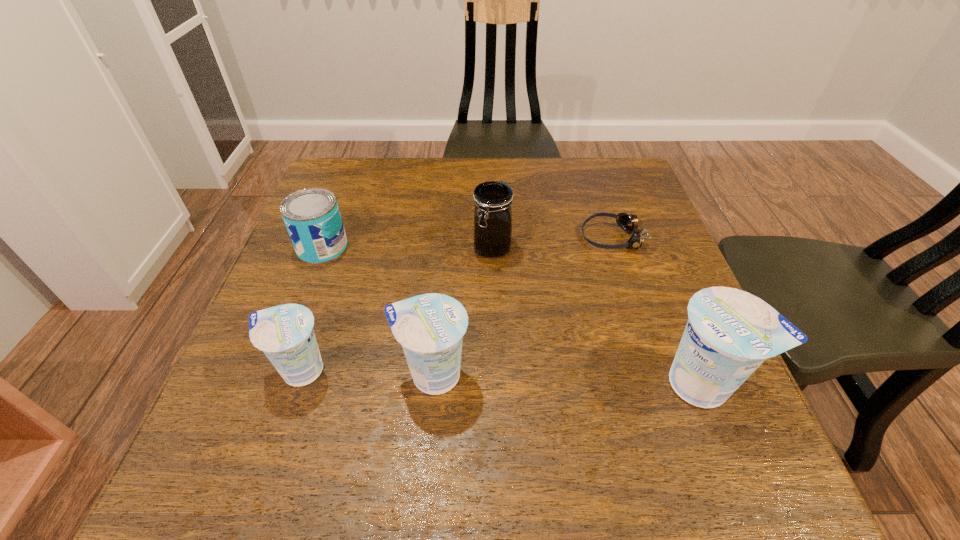
Locate an element on the screen. The image size is (960, 540). object that is at the near right corner is located at coordinates (730, 333).

Identify the location of blank space at the far edge of the desktop. The width and height of the screenshot is (960, 540). pyautogui.click(x=417, y=186).

The image size is (960, 540). I want to click on vacant space at the near edge of the desktop, so click(332, 431).

The image size is (960, 540). In order to click on vacant space at the left edge of the desktop in this screenshot , I will do `click(346, 212)`.

In the image, there is a desktop. What are the coordinates of `vacant space at the right edge` in the screenshot? It's located at (650, 311).

In the image, there is a desktop. Where is `vacant space at the far left corner`? The image size is (960, 540). vacant space at the far left corner is located at coordinates (350, 190).

You are a GUI agent. You are given a task and a screenshot of the screen. Output one action in this format:
    pyautogui.click(x=<x>, y=<y>)
    Task: Click on the free space at the far right corner
    
    Given the screenshot: What is the action you would take?
    596,180

Find the location of a particular element. The height and width of the screenshot is (540, 960). vacant position at the near right corner of the desktop is located at coordinates (651, 399).

I want to click on vacant region between the rightmost yogurt and the can, so click(513, 315).

I want to click on vacant space in between the goggles and the fourth object from left to right, so click(552, 242).